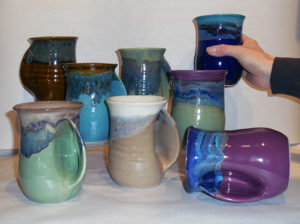
At what (x,y) coordinates should I click in order to perform the action: click on table. Please return your answer as a coordinate pair (x, y). Image resolution: width=300 pixels, height=224 pixels. Looking at the image, I should click on (100, 200).